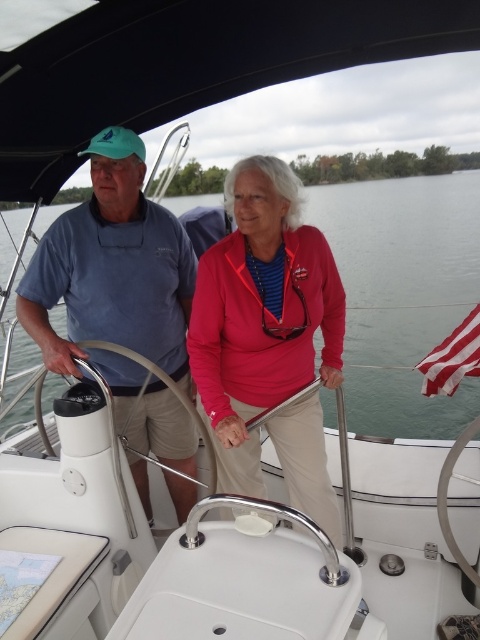
Question: Which object is closer to the camera taking this photo?

Choices:
 (A) striped fabric flag at right
 (B) matte red jacket at center
 (C) matte blue shirt at center

Answer: (B)

Question: Which object appears closest to the camera in this image?

Choices:
 (A) matte blue shirt at center
 (B) striped fabric flag at right
 (C) clear water at center

Answer: (A)

Question: Can you confirm if matte red jacket at center is positioned below striped fabric flag at right?

Choices:
 (A) yes
 (B) no

Answer: (A)

Question: Estimate the real-world distances between objects in this image. Which object is closer to the striped fabric flag at right?

Choices:
 (A) matte blue shirt at center
 (B) matte red jacket at center
 (C) clear water at center

Answer: (B)

Question: Does clear water at center have a greater width compared to matte blue shirt at center?

Choices:
 (A) no
 (B) yes

Answer: (B)

Question: Can you confirm if matte red jacket at center is bigger than matte blue shirt at center?

Choices:
 (A) no
 (B) yes

Answer: (A)